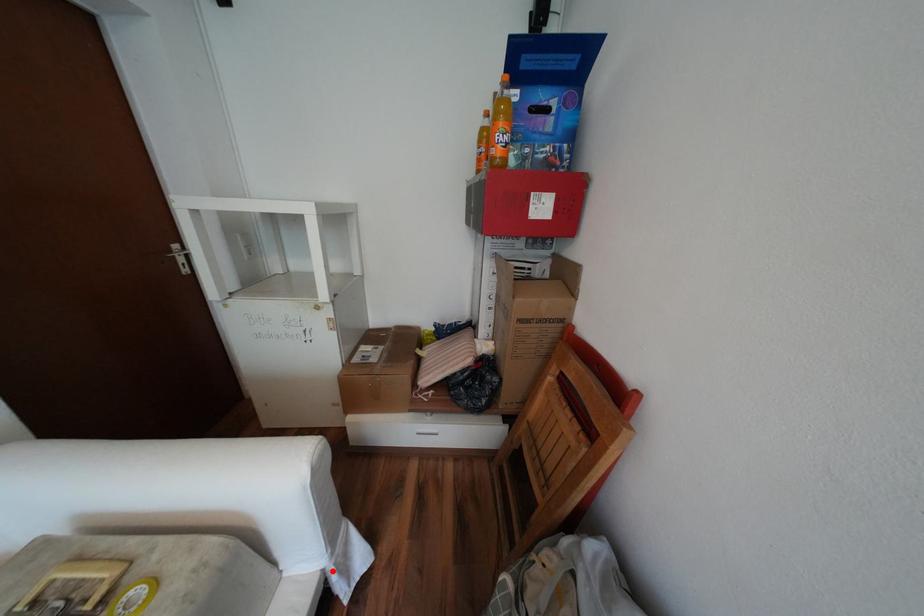
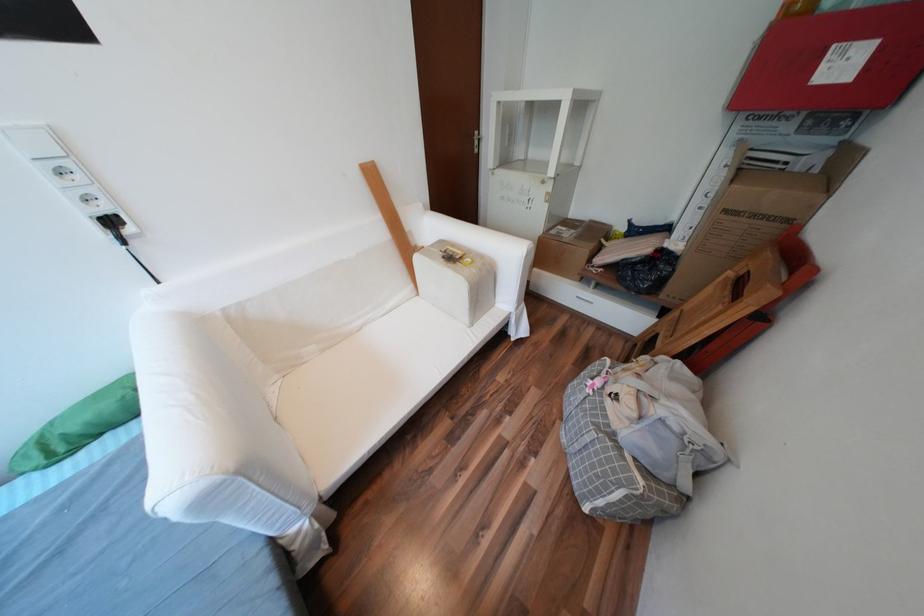
Locate, in the second image, the point that corresponds to the highlighted location in the first image.

(519, 313)